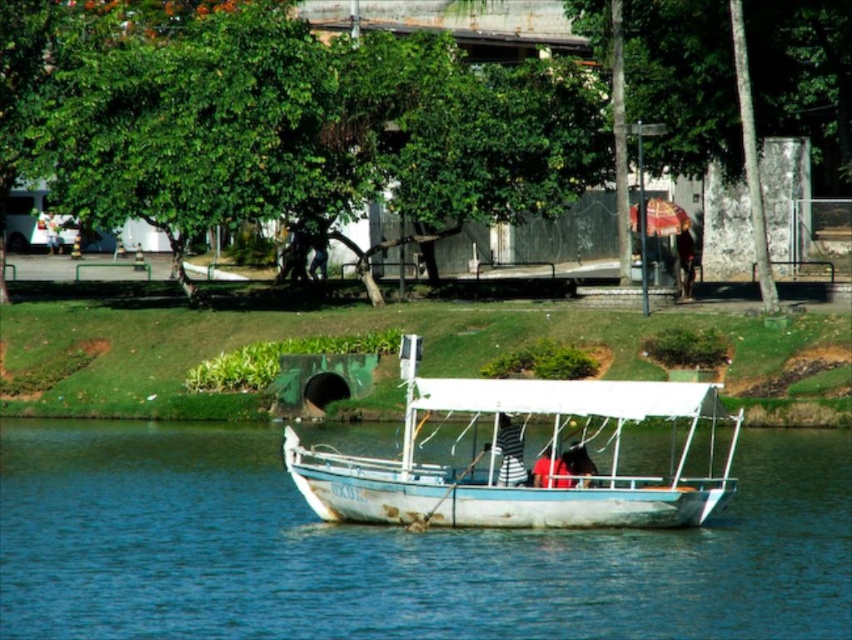
You are standing at the origin point of the coordinate system. The blue wooden boat at center is located at coordinates 0.861, 0.460. If you want to throw a lifebuoy to the boat, in which direction should you aim?

The blue wooden boat at center is located at coordinates (390, 550), so you should aim in the positive x and y direction to reach it.

You are standing at the position of the camera and want to take a photo of the green leafy tree at center. If your camera has a maximum focus range of 40 meters, will you be able to focus on the tree?

The green leafy tree at center and camera are 42.64 meters apart, which exceeds the camera maximum focus range of 40 meters. So you won not be able to focus on the tree.

You are standing at the riverside and want to take a photo of both point (492, 99) and point (524, 480). Which point will appear closer to the center of your camera view?

Point (492, 99) is further to the camera than point (524, 480), so point (524, 480) will appear closer to the center of your camera view.